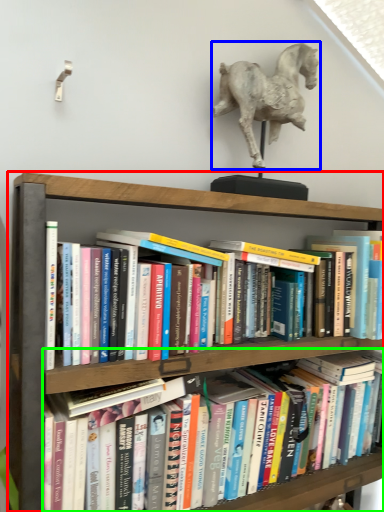
Question: Estimate the real-world distances between objects in this image. Which object is closer to shelf (highlighted by a red box), horse (highlighted by a blue box) or book (highlighted by a green box)?

Choices:
 (A) horse
 (B) book

Answer: (A)